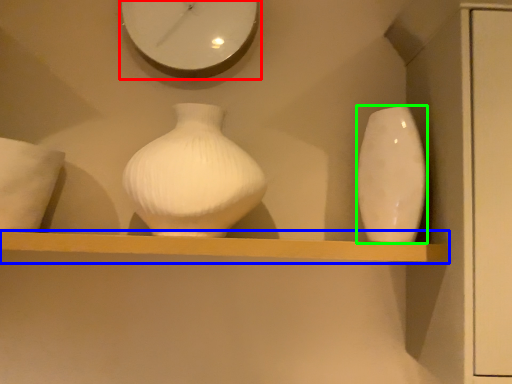
Question: Which object is the farthest from clock (highlighted by a red box)? Choose among these: shelf (highlighted by a blue box) or vase (highlighted by a green box).

Choices:
 (A) shelf
 (B) vase

Answer: (A)